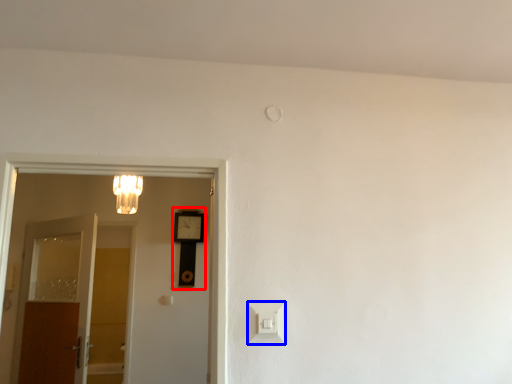
Question: Which point is closer to the camera, clock (highlighted by a red box) or light switch (highlighted by a blue box)?

Choices:
 (A) clock
 (B) light switch

Answer: (B)